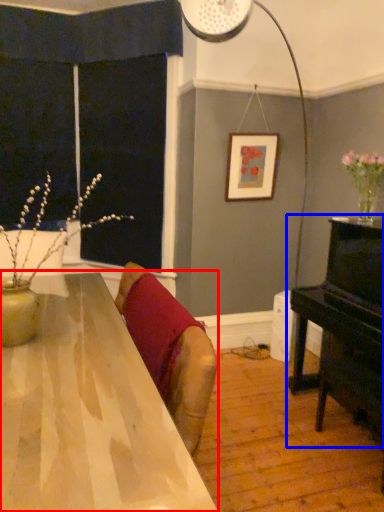
Question: Which point is further to the camera, table (highlighted by a red box) or piano (highlighted by a blue box)?

Choices:
 (A) table
 (B) piano

Answer: (B)